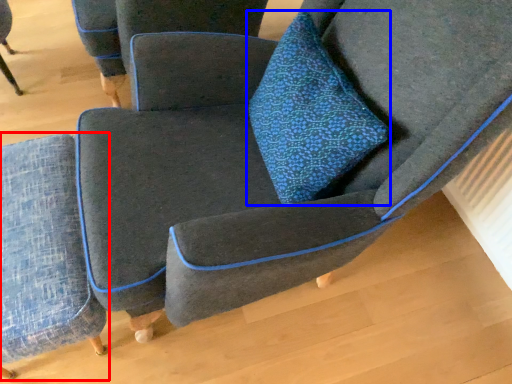
Question: Which of the following is the closest to the observer, chair (highlighted by a red box) or throw pillow (highlighted by a blue box)?

Choices:
 (A) chair
 (B) throw pillow

Answer: (B)